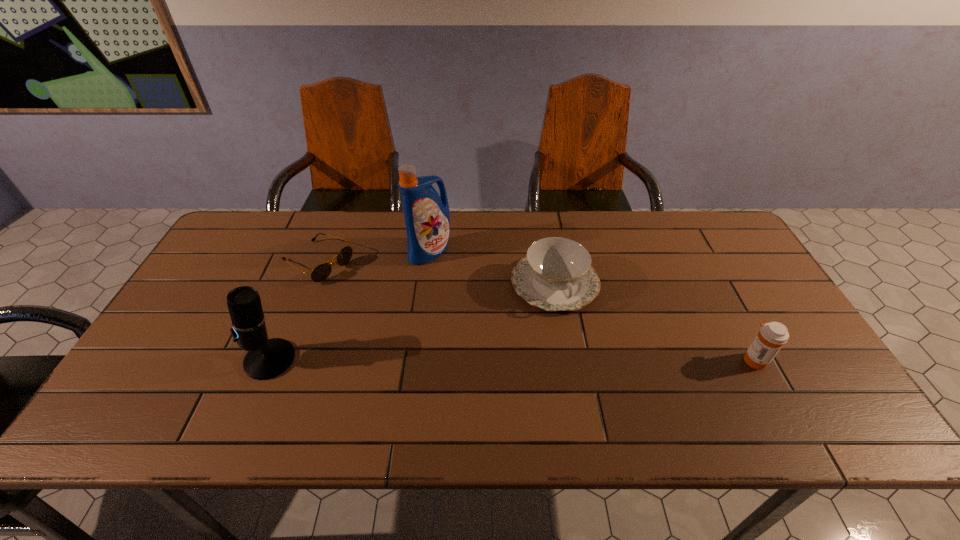
Find the location of a particular element. vacant point at the far left corner is located at coordinates (261, 231).

The image size is (960, 540). I want to click on vacant position at the far right corner of the desktop, so click(715, 249).

The height and width of the screenshot is (540, 960). I want to click on vacant space at the near right corner of the desktop, so click(x=807, y=368).

Image resolution: width=960 pixels, height=540 pixels. I want to click on free space that is in between the fourth object from left to right and the shortest object, so click(436, 273).

Where is `vacant area between the shortest object and the fourth shortest object`? The width and height of the screenshot is (960, 540). vacant area between the shortest object and the fourth shortest object is located at coordinates (294, 311).

Locate an element on the screen. The height and width of the screenshot is (540, 960). free space between the rightmost object and the shortest object is located at coordinates click(x=537, y=311).

The image size is (960, 540). Identify the location of vacant area between the tallest object and the microphone. (349, 305).

Image resolution: width=960 pixels, height=540 pixels. I want to click on vacant space that is in between the shortest object and the second shortest object, so click(x=436, y=273).

Locate an element on the screen. The height and width of the screenshot is (540, 960). free point between the second tallest object and the detergent is located at coordinates (349, 305).

The width and height of the screenshot is (960, 540). In order to click on vacant point located between the shortest object and the microphone in this screenshot , I will do `click(294, 311)`.